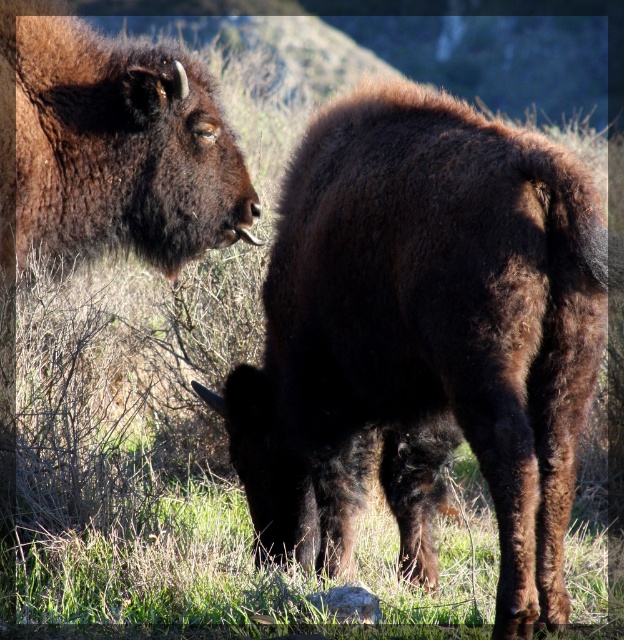
Is dark brown fur at center smaller than dark brown fur at upper left?

No, dark brown fur at center is not smaller than dark brown fur at upper left.

Who is higher up, dark brown fur at center or dark brown fur at upper left?

dark brown fur at upper left

Locate an element on the screen. The height and width of the screenshot is (640, 624). dark brown fur at center is located at coordinates (424, 337).